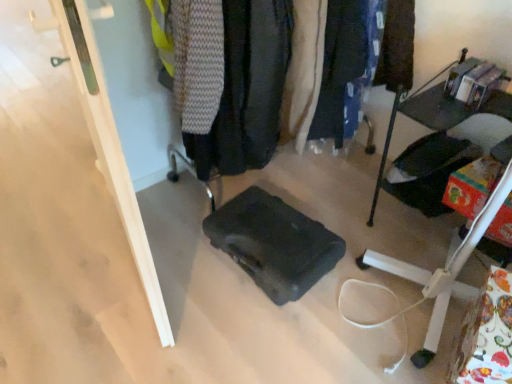
Question: Is black matte suitcase at center not inside dark gray fabric at center?

Choices:
 (A) no
 (B) yes

Answer: (B)

Question: Is dark gray fabric at center at the back of black matte suitcase at center?

Choices:
 (A) no
 (B) yes

Answer: (A)

Question: Is the depth of black matte suitcase at center less than that of dark gray fabric at center?

Choices:
 (A) no
 (B) yes

Answer: (A)

Question: Is black matte suitcase at center taller than dark gray fabric at center?

Choices:
 (A) no
 (B) yes

Answer: (A)

Question: From the image's perspective, is black matte suitcase at center on dark gray fabric at center?

Choices:
 (A) yes
 (B) no

Answer: (B)

Question: Is black matte suitcase at center taller or shorter than dark blue fabric pants at center, which is the 1th clothing from right to left?

Choices:
 (A) short
 (B) tall

Answer: (A)

Question: From the image's perspective, is black matte suitcase at center located above or below dark blue fabric pants at center, which is the 1th clothing from right to left?

Choices:
 (A) above
 (B) below

Answer: (B)

Question: Considering their positions, is black matte suitcase at center located in front of or behind dark blue fabric pants at center, which is the 1th clothing from right to left?

Choices:
 (A) behind
 (B) front

Answer: (B)

Question: Is black matte suitcase at center inside or outside of dark blue fabric pants at center, positioned as the 2th clothing in left-to-right order?

Choices:
 (A) outside
 (B) inside

Answer: (A)

Question: Is dark blue fabric pants at center, positioned as the 2th clothing in left-to-right order, bigger or smaller than metallic black shelf at right?

Choices:
 (A) small
 (B) big

Answer: (A)

Question: Relative to metallic black shelf at right, is dark blue fabric pants at center, which is the 1th clothing from right to left, in front or behind?

Choices:
 (A) behind
 (B) front

Answer: (A)

Question: Looking at their shapes, would you say dark blue fabric pants at center, which is the 1th clothing from right to left, is wider or thinner than metallic black shelf at right?

Choices:
 (A) thin
 (B) wide

Answer: (A)

Question: Is point (347, 29) closer or farther from the camera than point (477, 221)?

Choices:
 (A) farther
 (B) closer

Answer: (A)

Question: Considering the positions of metallic black shelf at right and dark gray fabric jacket at center, which appears as the 1th clothing when viewed from the left, in the image, is metallic black shelf at right wider or thinner than dark gray fabric jacket at center, which appears as the 1th clothing when viewed from the left,?

Choices:
 (A) wide
 (B) thin

Answer: (B)

Question: From the image's perspective, is metallic black shelf at right located above or below dark gray fabric jacket at center, which appears as the 1th clothing when viewed from the left?

Choices:
 (A) above
 (B) below

Answer: (B)